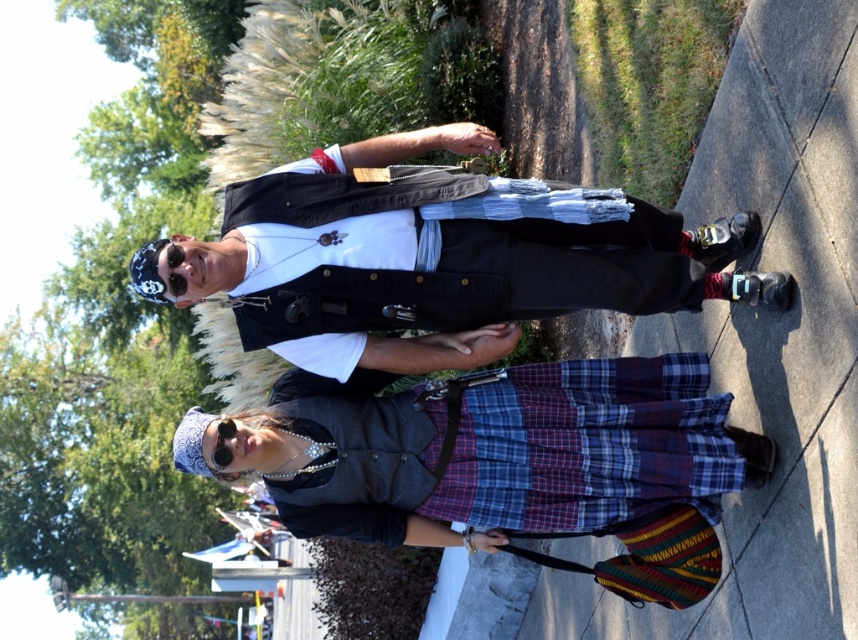
You are a fashion designer observing two people on a sidewalk. You notice the matte black vest at center and the plaid fabric skirt at center. Which clothing item is located to the left of the other?

The matte black vest at center is positioned on the left side of plaid fabric skirt at center.

You are a fashion designer observing two outfits in the scene. The matte black vest at center and the plaid fabric skirt at center are both in the same location. Which of these two items has a bigger size?

The matte black vest at center has a larger size compared to the plaid fabric skirt at center.

From the picture: You are a fashion designer observing two people on a sidewalk. You notice the matte black vest at center and the plaid fabric skirt at center. Which clothing item is wider?

The matte black vest at center is wider than the plaid fabric skirt at center according to the description.